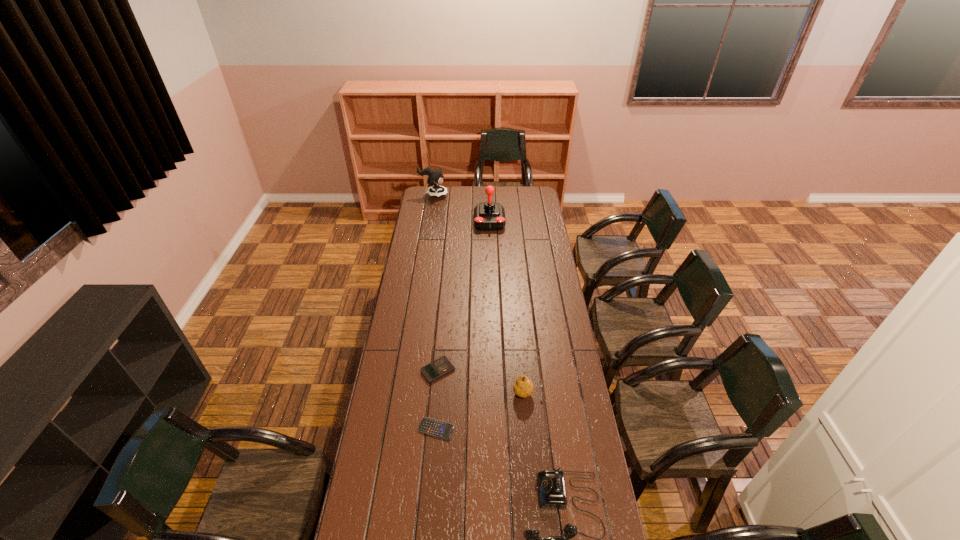
This screenshot has width=960, height=540. Identify the location of the fifth nearest object. (489, 216).

Locate an element on the screen. Image resolution: width=960 pixels, height=540 pixels. the farthest object is located at coordinates (435, 176).

Find the location of a particular element. The width and height of the screenshot is (960, 540). the third nearest object is located at coordinates (523, 387).

Locate an element on the screen. the taller calculator is located at coordinates (442, 366).

The height and width of the screenshot is (540, 960). In order to click on the farther calculator in this screenshot , I will do `click(442, 366)`.

You are a GUI agent. You are given a task and a screenshot of the screen. Output one action in this format:
    pyautogui.click(x=<x>, y=<y>)
    Task: Click on the nearer calculator
    The width and height of the screenshot is (960, 540).
    Given the screenshot: What is the action you would take?
    pyautogui.click(x=430, y=426)

Locate an element on the screen. the shortest object is located at coordinates (430, 426).

Identify the location of free space located on the base of the fifth nearest object. This screenshot has width=960, height=540. (491, 274).

I want to click on free space located at the face of the doll, so click(462, 195).

Where is `vacant space located on the left of the third nearest object`? The width and height of the screenshot is (960, 540). vacant space located on the left of the third nearest object is located at coordinates coord(498,393).